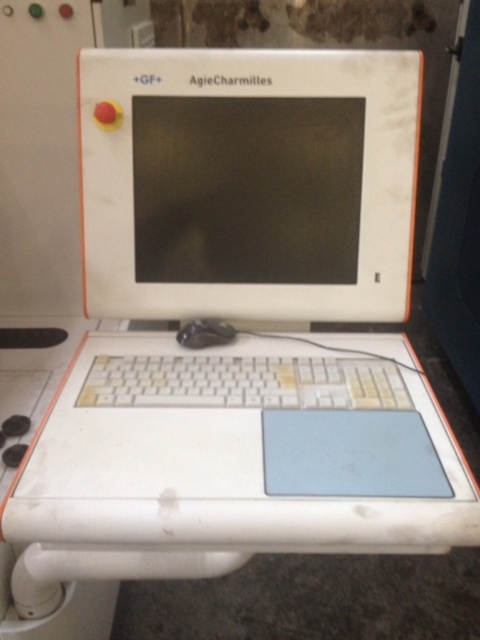
Is the position of white matte computer at center less distant than that of black rubber mouse at center?

Yes, it is in front of black rubber mouse at center.

Can you confirm if white matte computer at center is positioned to the right of black rubber mouse at center?

Correct, you'll find white matte computer at center to the right of black rubber mouse at center.

Is point (325, 88) more distant than point (181, 340)?

No, (325, 88) is in front of (181, 340).

The height and width of the screenshot is (640, 480). In order to click on white matte computer at center in this screenshot , I will do `click(249, 182)`.

Is white plastic table at center closer to the viewer compared to white plastic keyboard at center?

Yes, it is in front of white plastic keyboard at center.

The width and height of the screenshot is (480, 640). Find the location of `white plastic table at center`. white plastic table at center is located at coordinates (283, 602).

Which of these two, white plastic monitor at center or white plastic keyboard at center, stands shorter?

With less height is white plastic keyboard at center.

From the picture: Who is positioned more to the left, white plastic monitor at center or white plastic keyboard at center?

white plastic keyboard at center

This screenshot has width=480, height=640. I want to click on white plastic monitor at center, so [249, 182].